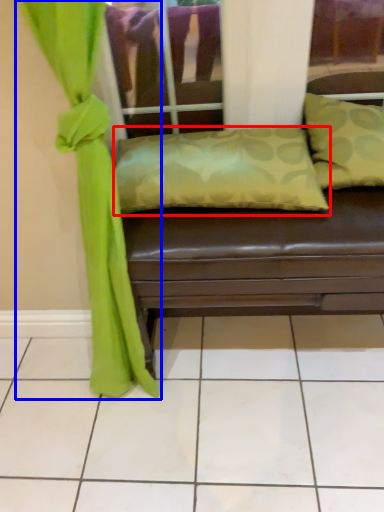
Question: Which of the following is the farthest to the observer, pillow (highlighted by a red box) or curtain (highlighted by a blue box)?

Choices:
 (A) pillow
 (B) curtain

Answer: (A)